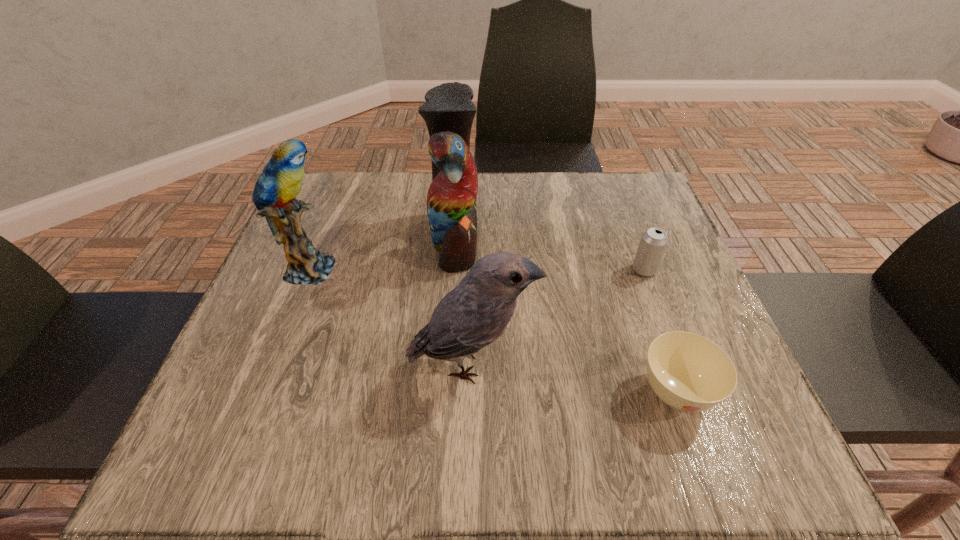
Where is `the leftmost parrot`? The width and height of the screenshot is (960, 540). the leftmost parrot is located at coordinates (281, 181).

Where is `the third tallest object`? This screenshot has height=540, width=960. the third tallest object is located at coordinates (476, 312).

This screenshot has width=960, height=540. Find the location of `the shortest parrot`. the shortest parrot is located at coordinates (476, 312).

Identify the location of beer can. This screenshot has width=960, height=540. click(x=653, y=243).

Locate an element on the screen. Image resolution: width=960 pixels, height=540 pixels. sugar bowl is located at coordinates (688, 372).

Where is `vacant point located on the face of the leftmost object`? This screenshot has width=960, height=540. vacant point located on the face of the leftmost object is located at coordinates (372, 269).

The height and width of the screenshot is (540, 960). I want to click on vacant space located on the front-facing side of the third tallest object, so click(x=703, y=363).

Find the location of `vacant region located 0.240m on the left of the second shortest object`. vacant region located 0.240m on the left of the second shortest object is located at coordinates coord(521,270).

In order to click on free space located on the back of the shortest object in this screenshot , I will do `click(615, 222)`.

This screenshot has height=540, width=960. Identify the location of object that is at the far edge. (449, 111).